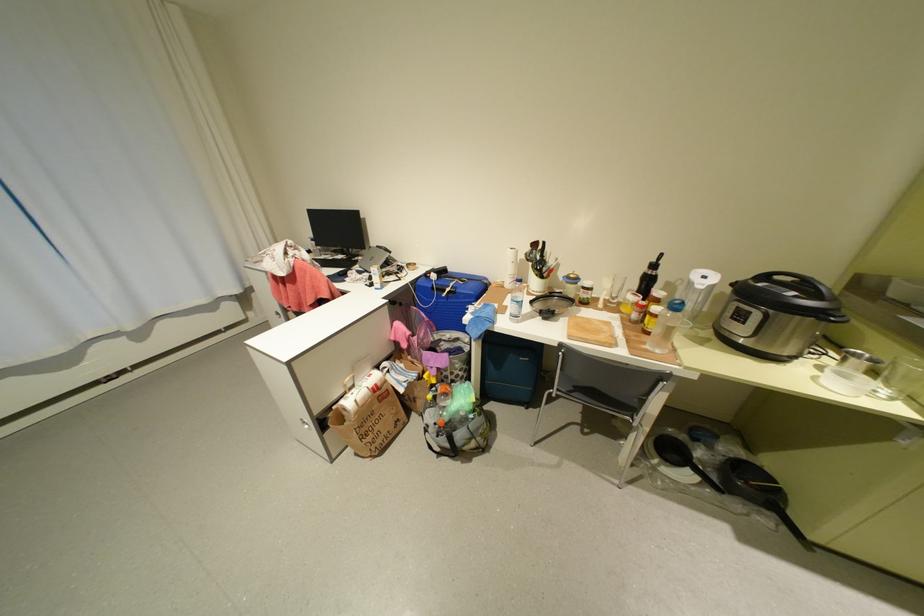
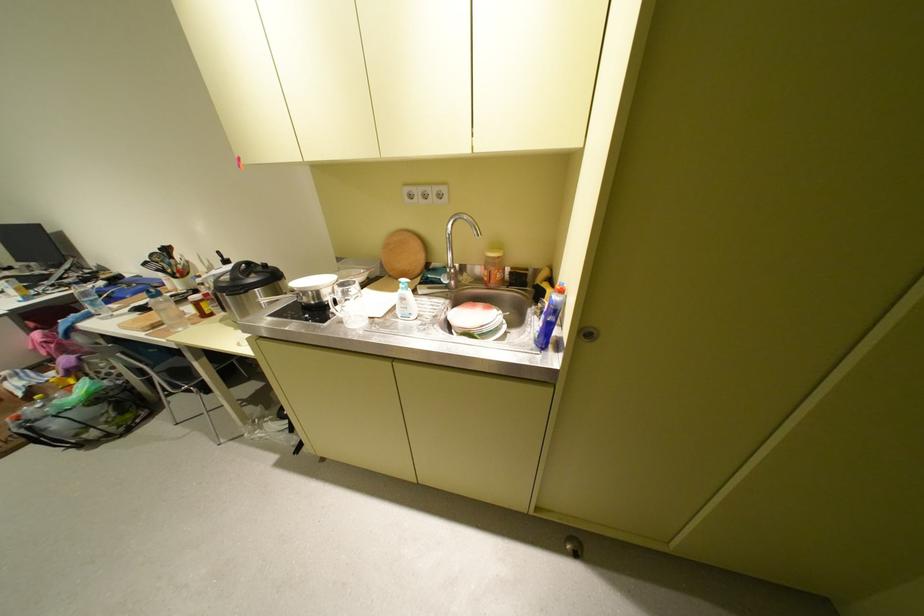
Question: Which direction would the cameraman need to move to produce the second image? Reply with the corresponding letter.

Choices:
 (A) Left
 (B) Right
 (C) Forward
 (D) Backward

Answer: (B)